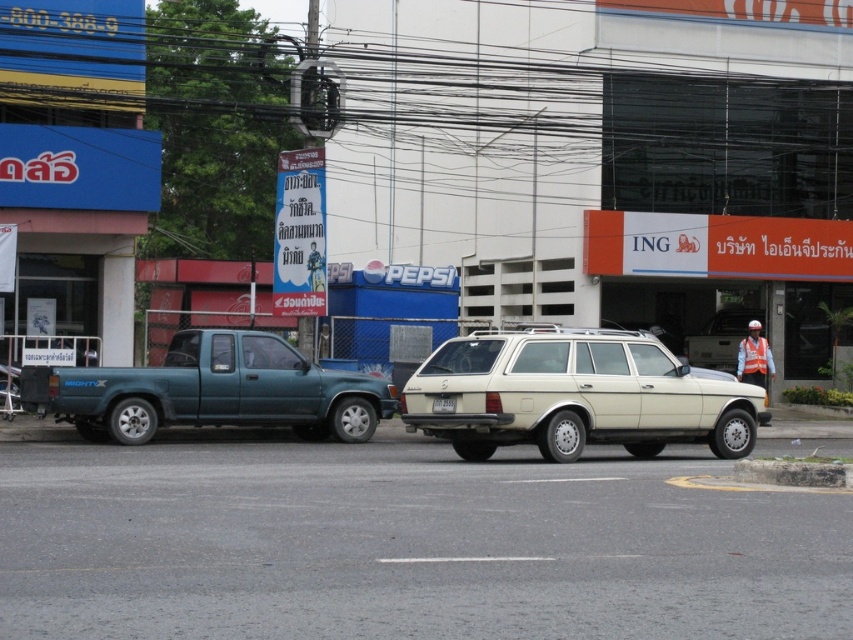
Question: Is beige matte station wagon at center to the right of white plastic license plate at center from the viewer's perspective?

Choices:
 (A) yes
 (B) no

Answer: (A)

Question: Which point is closer to the camera?

Choices:
 (A) (438, 396)
 (B) (107, 416)
 (C) (521, 433)

Answer: (C)

Question: Which object appears closest to the camera in this image?

Choices:
 (A) beige matte station wagon at center
 (B) teal matte truck at left

Answer: (A)

Question: Is beige matte station wagon at center bigger than white plastic license plate at center?

Choices:
 (A) yes
 (B) no

Answer: (A)

Question: Is beige matte station wagon at center closer to the viewer compared to white plastic license plate at center?

Choices:
 (A) yes
 (B) no

Answer: (A)

Question: Based on their relative distances, which object is nearer to the beige matte station wagon at center?

Choices:
 (A) teal matte truck at left
 (B) white plastic license plate at center

Answer: (B)